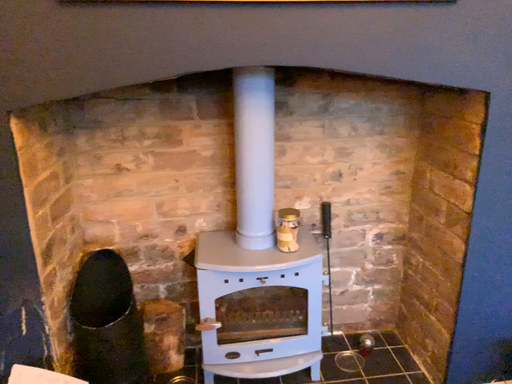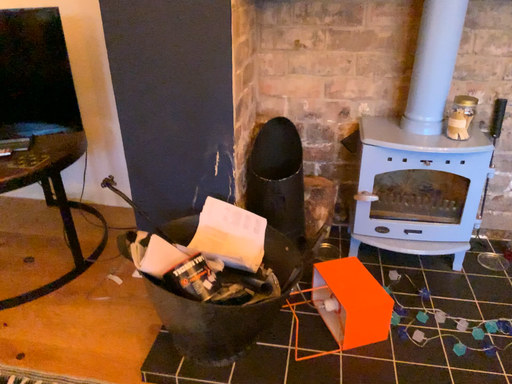
Question: How did the camera likely rotate when shooting the video?

Choices:
 (A) rotated downward
 (B) rotated upward

Answer: (A)